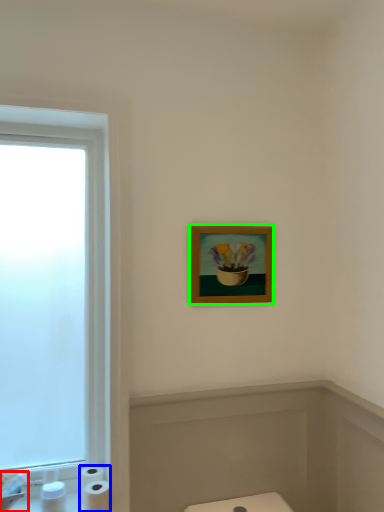
Question: Which object is the closest to the sink (highlighted by a red box)? Choose among these: toilet paper (highlighted by a blue box) or picture frame (highlighted by a green box).

Choices:
 (A) toilet paper
 (B) picture frame

Answer: (A)